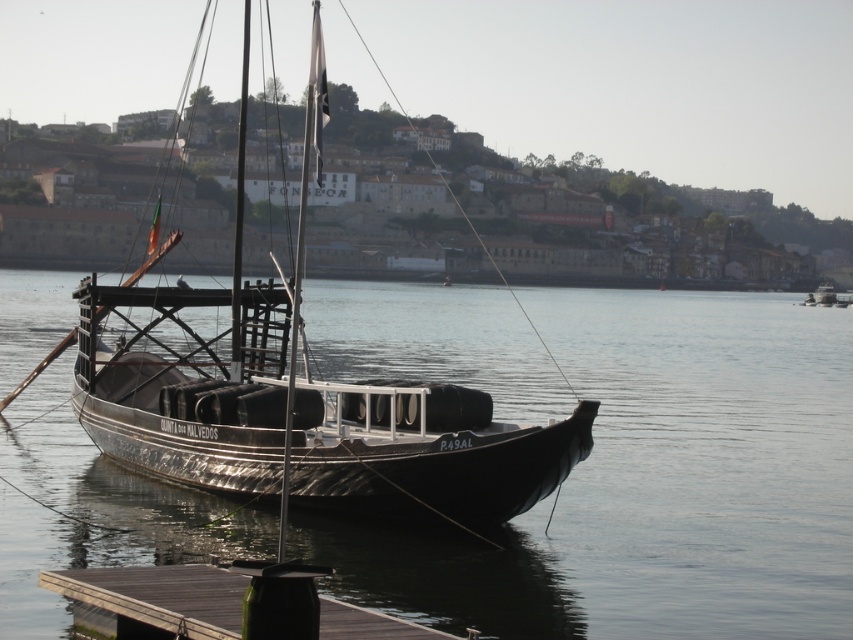
You are standing on the pier looking at the rabelo boat. There are two points marked on the boat. The first point is at coordinates point (x=732, y=314) and the second point is at point (x=115, y=579). Which point is closer to you?

Point (x=115, y=579) is closer to you because it is less further to the camera than point (x=732, y=314).

You are standing on the pier and see the black smooth water at center and the wooden sailboat at center. Which object is positioned to the right of the other?

The black smooth water at center is to the right of the wooden sailboat at center.

You are standing on the pier where the rabelo boat is docked. You notice a point marked at coordinates (654, 484). What is located at this point?

The point at coordinates (654, 484) corresponds to black smooth water at center.